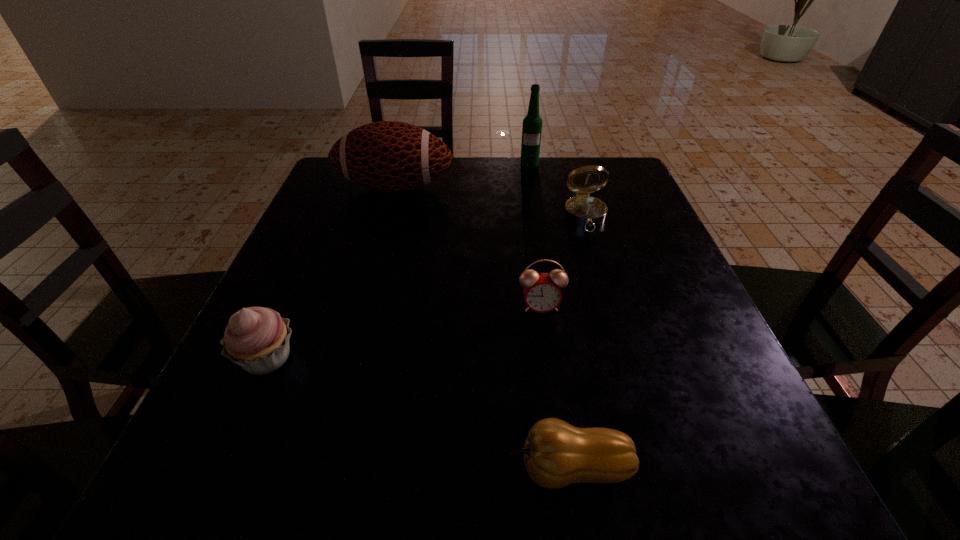
You are a GUI agent. You are given a task and a screenshot of the screen. Output one action in this format:
    pyautogui.click(x=<x>, y=<y>)
    Task: Click on the football that is at the left edge
    This screenshot has width=960, height=540.
    Given the screenshot: What is the action you would take?
    pyautogui.click(x=388, y=156)

Image resolution: width=960 pixels, height=540 pixels. I want to click on cupcake that is at the left edge, so click(x=256, y=338).

The image size is (960, 540). Identify the location of object present at the right edge. [582, 210].

Identify the location of object that is positioned at the far left corner. This screenshot has width=960, height=540. (388, 156).

Where is `object located in the far right corner section of the desktop`? object located in the far right corner section of the desktop is located at coordinates (582, 210).

Where is `vacant space at the far edge`? Image resolution: width=960 pixels, height=540 pixels. vacant space at the far edge is located at coordinates (492, 166).

Image resolution: width=960 pixels, height=540 pixels. In order to click on vacant region at the near edge in this screenshot , I will do `click(428, 461)`.

You are a GUI agent. You are given a task and a screenshot of the screen. Output one action in this format:
    pyautogui.click(x=<x>, y=<y>)
    Task: Click on the free location at the left edge
    
    Given the screenshot: What is the action you would take?
    pyautogui.click(x=312, y=347)

Image resolution: width=960 pixels, height=540 pixels. In order to click on vacant region at the right edge in this screenshot , I will do `click(611, 288)`.

The image size is (960, 540). What are the coordinates of `vacant area at the far right corner of the desktop` in the screenshot? It's located at (605, 160).